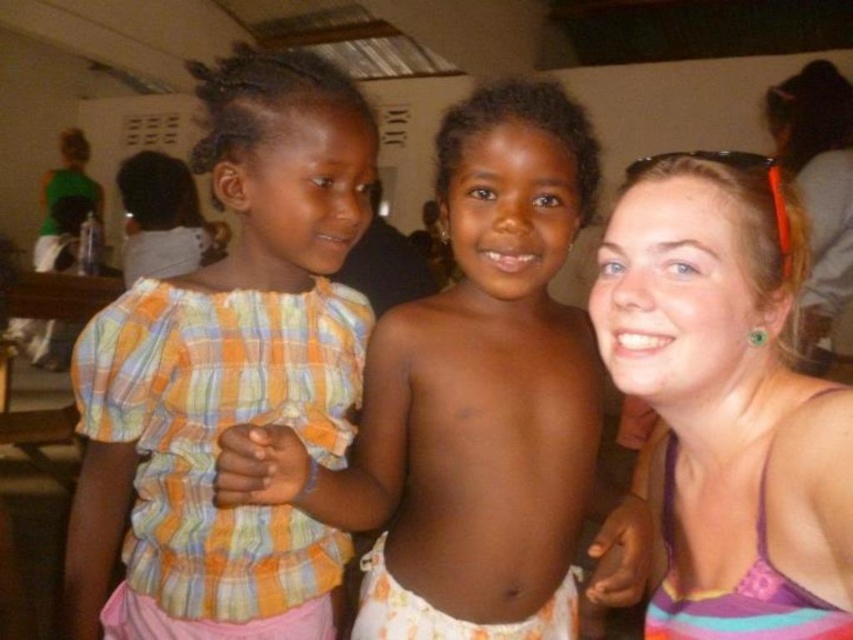
Question: Is plaid fabric shirt at left positioned behind pink fabric tank top at right?

Choices:
 (A) yes
 (B) no

Answer: (A)

Question: Which object is closer to the camera taking this photo?

Choices:
 (A) pink fabric tank top at right
 (B) white cotton shorts at center
 (C) plaid fabric shirt at center

Answer: (A)

Question: Is plaid fabric shirt at left thinner than white cotton shorts at center?

Choices:
 (A) yes
 (B) no

Answer: (B)

Question: Does plaid fabric shirt at left appear under plaid fabric shirt at center?

Choices:
 (A) yes
 (B) no

Answer: (A)

Question: Among these objects, which one is nearest to the camera?

Choices:
 (A) white cotton shorts at center
 (B) pink fabric at lower left
 (C) pink fabric tank top at right

Answer: (C)

Question: Which point is farther to the camera?

Choices:
 (A) (334, 620)
 (B) (786, 458)
 (C) (215, 449)
 (D) (424, 550)

Answer: (A)